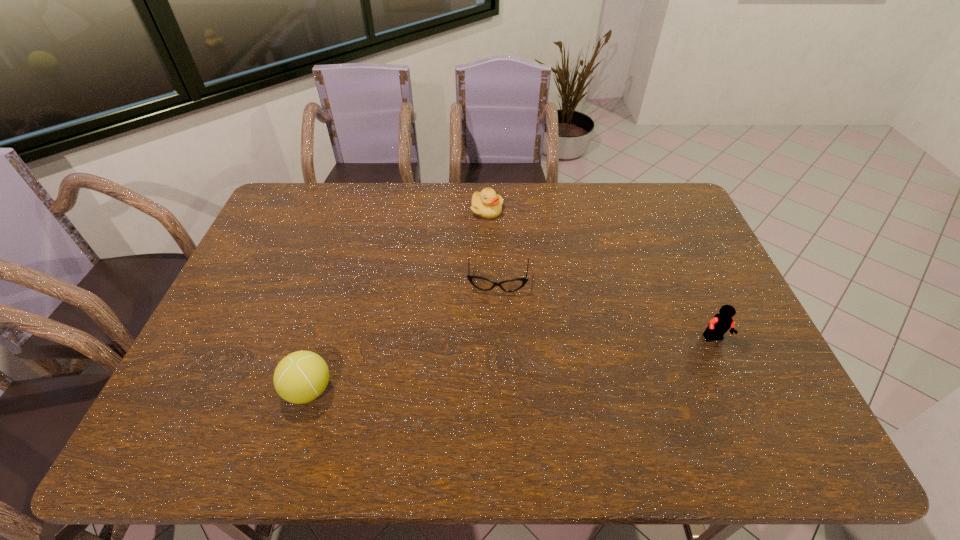
Where is `blank space at the near edge`? Image resolution: width=960 pixels, height=540 pixels. blank space at the near edge is located at coordinates (651, 391).

At what (x,y) coordinates should I click in order to perform the action: click on vacant area at the left edge. Please return your answer as a coordinate pair (x, y). This screenshot has width=960, height=540. Looking at the image, I should click on (235, 308).

The width and height of the screenshot is (960, 540). I want to click on free point at the right edge, so click(693, 266).

What are the coordinates of `vacant area at the far right corner of the desktop` in the screenshot? It's located at [654, 197].

Image resolution: width=960 pixels, height=540 pixels. In order to click on free space between the tennis ball and the rightmost object in this screenshot , I will do `click(512, 364)`.

The height and width of the screenshot is (540, 960). In order to click on vacant point located between the third farthest object and the second farthest object in this screenshot , I will do `click(606, 310)`.

At what (x,y) coordinates should I click in order to perform the action: click on vacant area that lies between the leftmost object and the farthest object. Please return your answer as a coordinate pair (x, y). This screenshot has height=540, width=960. Looking at the image, I should click on (397, 300).

Where is `free space between the spectacles and the nearest object`? free space between the spectacles and the nearest object is located at coordinates (403, 336).

You are a GUI agent. You are given a task and a screenshot of the screen. Output one action in this format:
    pyautogui.click(x=<x>, y=<y>)
    Task: Click on the vacant space that is in between the duckling and the nearest object
    This screenshot has height=540, width=960.
    Given the screenshot: What is the action you would take?
    pyautogui.click(x=397, y=300)

At what (x,y) coordinates should I click in order to perform the action: click on vacant area that lies between the shortest object and the nearest object. Please return your answer as a coordinate pair (x, y). Looking at the image, I should click on (403, 336).